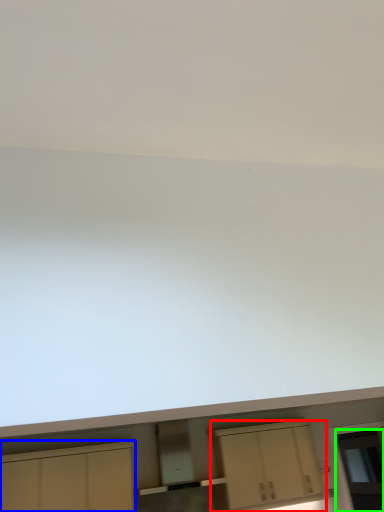
Question: Which is nearer to the cabinetry (highlighted by a red box)? cabinetry (highlighted by a blue box) or glass door (highlighted by a green box).

Choices:
 (A) cabinetry
 (B) glass door

Answer: (B)